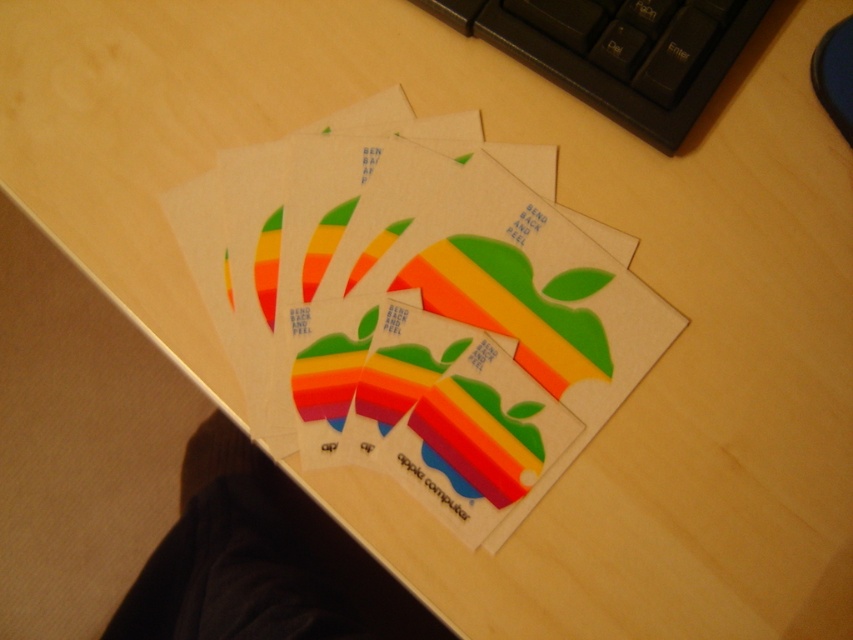
You are organizing a desk and see the matte paper card at center. Where exactly is it located on the desk?

The matte paper card at center is located at point coordinates of 0.487 on the x axis and 0.488 on the y axis.

You are organizing your desk and see the matte paper card at center and the black plastic keyboard at upper center. Which object is positioned to the left side of the other?

The matte paper card at center is to the left of the black plastic keyboard at upper center.

You are organizing your desk and need to move items closer to you. You have a matte paper card at center and a black plastic keyboard at upper center. Which item is already closer to you?

The matte paper card at center is closer to the viewer than the black plastic keyboard at upper center, so the matte paper card at center is already closer to you.